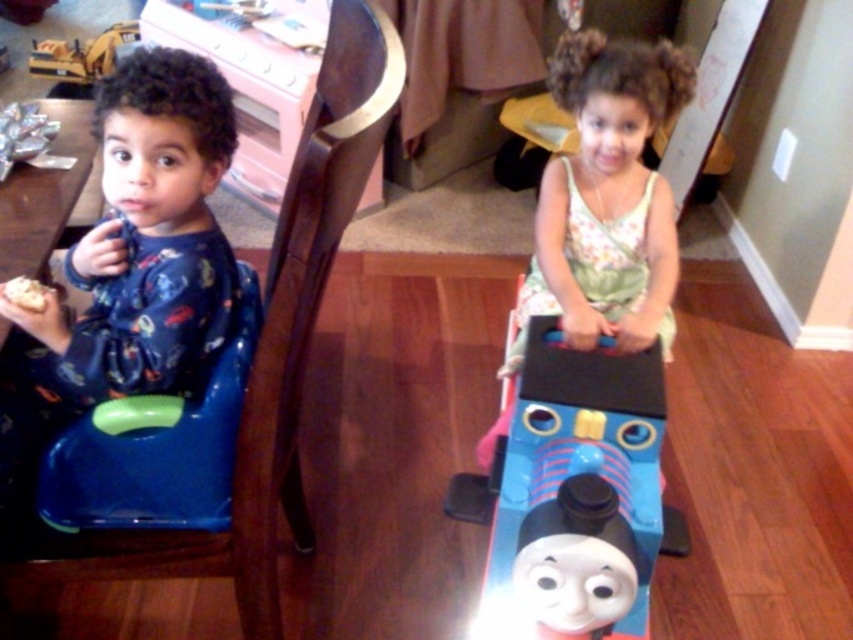
You are standing in the room and see two points marked in the image. Which point is closer to you, point (378, 140) or point (79, 72)?

Point (378, 140) is in front of point (79, 72), so it is closer to you.

You are a parent trying to decide whether to place a small stuffed animal between the blue plastic highchair at left and the yellow plastic toy at upper left. Considering their heights, which object should the stuffed animal be placed closer to in order to ensure stability?

The blue plastic highchair at left has a greater height compared to the yellow plastic toy at upper left, so placing the stuffed animal closer to the blue plastic highchair at left would provide better stability due to its taller structure.

You are a parent looking at the image of your children. You notice the matte blue pajamas at left and the blue plastic highchair at left. Which one is positioned further to the left side of the image?

The matte blue pajamas at left is positioned further to the left side of the image compared to the blue plastic highchair at left.